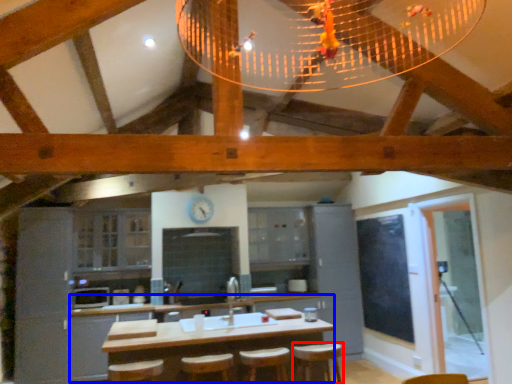
Question: Which object appears closest to the camera in this image, bar stool (highlighted by a red box) or counter (highlighted by a blue box)?

Choices:
 (A) bar stool
 (B) counter

Answer: (B)